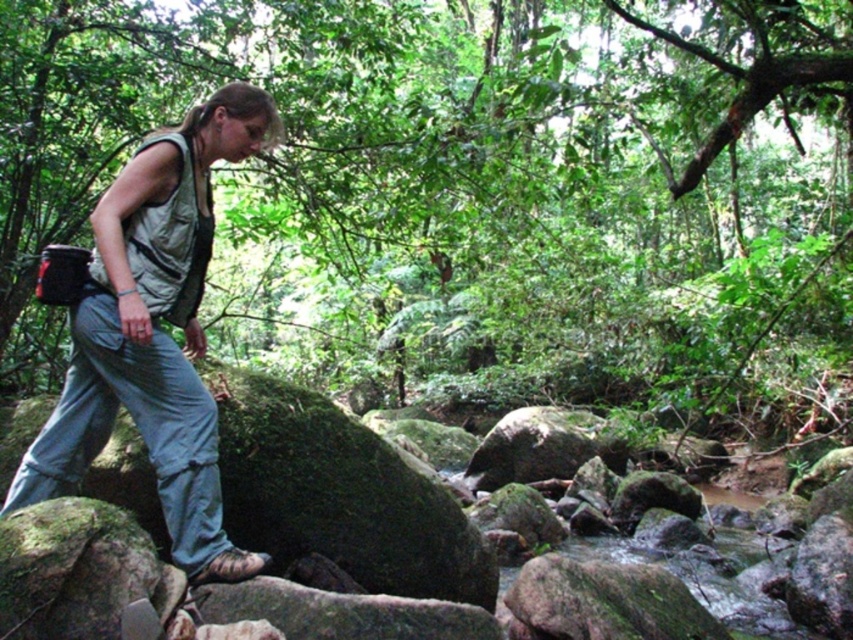
Is green mossy rocks at center further to the viewer compared to light gray fabric vest at left?

Yes, it is.

Is point (254, 292) in front of point (128, 368)?

No, it is not.

Find the location of a particular element. The image size is (853, 640). green mossy rocks at center is located at coordinates (460, 173).